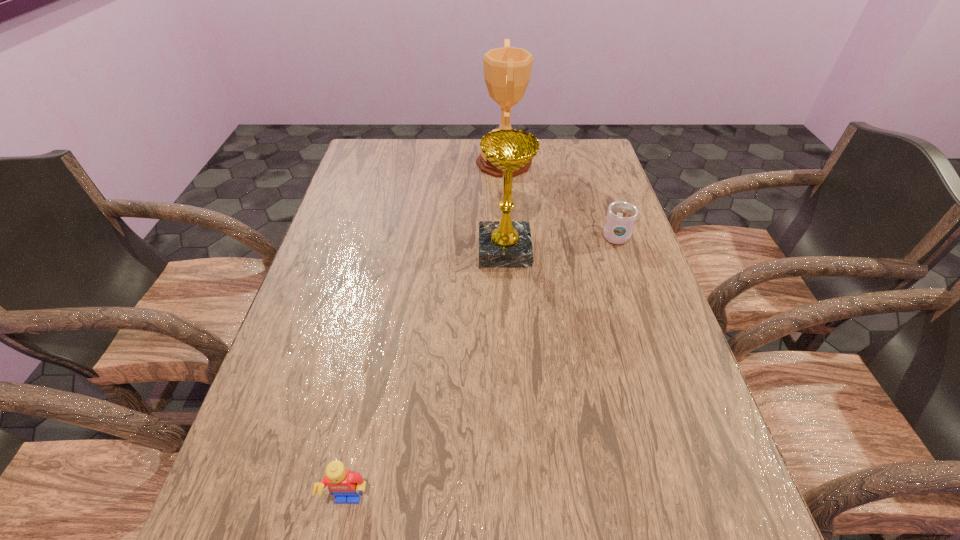
I want to click on object that is the second closest to the second tallest object, so point(507,70).

This screenshot has height=540, width=960. Find the location of `object that is the nearest to the Lego`. object that is the nearest to the Lego is located at coordinates (502, 244).

Where is `free point that satisfies the following two spatial constraints: 1. on the side with the handle of the cup; 2. on the front-facing side of the farther award`? This screenshot has width=960, height=540. free point that satisfies the following two spatial constraints: 1. on the side with the handle of the cup; 2. on the front-facing side of the farther award is located at coordinates (590, 163).

Locate an element on the screen. This screenshot has width=960, height=540. vacant position in the image that satisfies the following two spatial constraints: 1. on the front-facing side of the nearer award; 2. on the face of the leftmost object is located at coordinates (519, 502).

Where is `blank space that satisfies the following two spatial constraints: 1. on the front-facing side of the shorter award; 2. on the face of the Lego`? The height and width of the screenshot is (540, 960). blank space that satisfies the following two spatial constraints: 1. on the front-facing side of the shorter award; 2. on the face of the Lego is located at coordinates (519, 502).

This screenshot has height=540, width=960. What are the coordinates of `free space that satisfies the following two spatial constraints: 1. on the front-facing side of the farther award; 2. on the side with the handle of the rightmost object` in the screenshot? It's located at (509, 235).

Identify the location of vacant space that satisfies the following two spatial constraints: 1. on the side with the handle of the cup; 2. on the front-facing side of the farthest object. This screenshot has height=540, width=960. (590, 163).